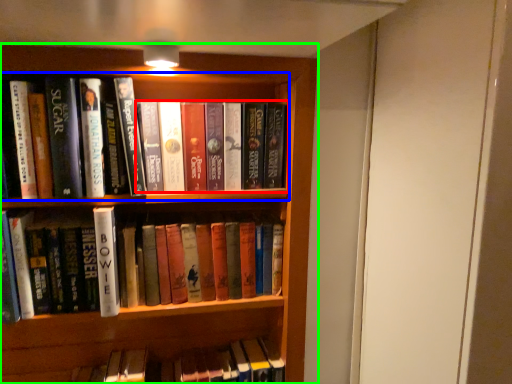
Question: Which object is the farthest from book (highlighted by a red box)? Choose among these: book (highlighted by a blue box) or bookcase (highlighted by a green box).

Choices:
 (A) book
 (B) bookcase

Answer: (B)